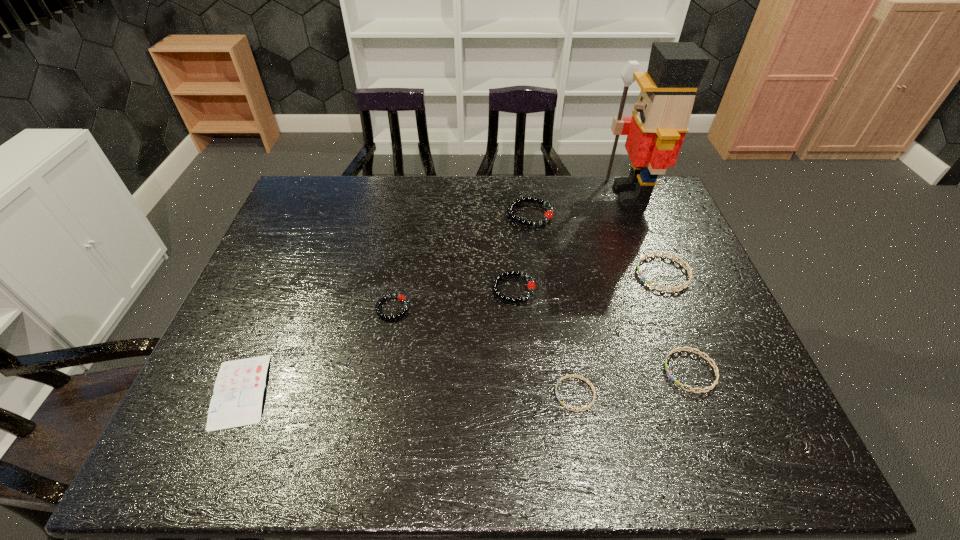
This screenshot has height=540, width=960. Find the location of `the shortest bracelet`. the shortest bracelet is located at coordinates (576, 376).

Identify the location of diary. The image size is (960, 540). (239, 388).

Locate an element on the screen. The image size is (960, 540). the shortest object is located at coordinates (239, 388).

The image size is (960, 540). Identify the location of vacant point located 0.050m in front of the tallest object holding the staff. (x=588, y=194).

Locate an element on the screen. vacant area located in front of the tallest object holding the staff is located at coordinates (588, 194).

The height and width of the screenshot is (540, 960). What are the coordinates of `free space located 0.120m in front of the tallest object holding the staff` in the screenshot? It's located at (568, 194).

Identify the location of vacant space located 0.150m on the front of the tallest bracelet. This screenshot has width=960, height=540. (537, 262).

The height and width of the screenshot is (540, 960). I want to click on vacant point located 0.400m on the surface of the biggest blue bracelet showing star-shaped elements, so click(496, 274).

The height and width of the screenshot is (540, 960). Find the location of `vacant space located 0.230m on the surface of the biggest blue bracelet showing star-shaped elements`. vacant space located 0.230m on the surface of the biggest blue bracelet showing star-shaped elements is located at coordinates (556, 274).

Find the location of a particular element. The width and height of the screenshot is (960, 540). free location located 0.240m on the surface of the biggest blue bracelet showing star-shaped elements is located at coordinates (553, 274).